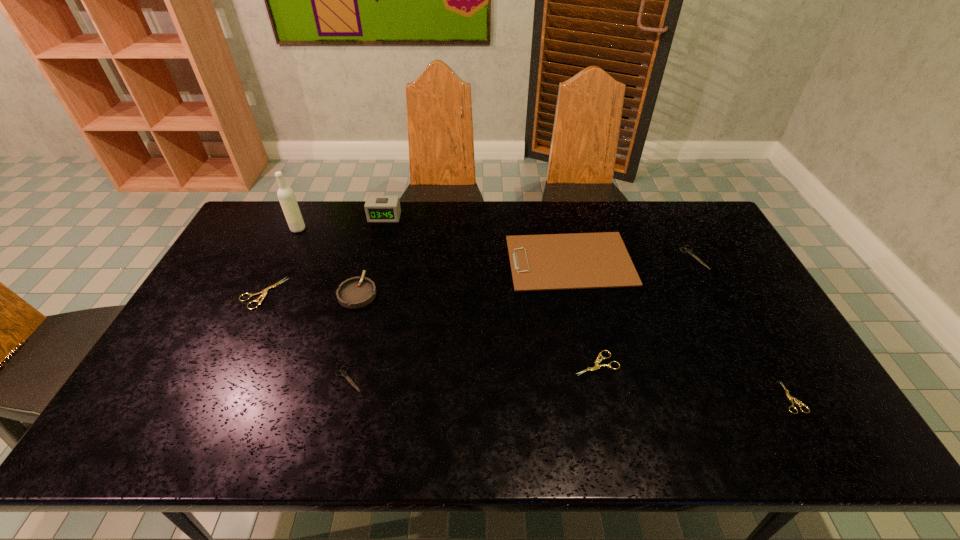
Where is `the fourth nearest shears`? Image resolution: width=960 pixels, height=540 pixels. the fourth nearest shears is located at coordinates (264, 293).

Where is `the farthest beige shears`? the farthest beige shears is located at coordinates (264, 293).

Identify the location of the second smallest beige shears. (597, 361).

Where is `the second nearest beige shears`? This screenshot has height=540, width=960. the second nearest beige shears is located at coordinates (597, 361).

The height and width of the screenshot is (540, 960). I want to click on the fourth shears from right to left, so click(x=343, y=373).

Image resolution: width=960 pixels, height=540 pixels. Identify the location of the smaller black shears. (343, 373).

Find the location of a particular element. the shortest object is located at coordinates (790, 398).

Locate an element on the screen. The image size is (960, 540). the nearest beige shears is located at coordinates (790, 398).

This screenshot has height=540, width=960. What are the coordinates of `vacant area situated on the right of the tallest object` in the screenshot? It's located at (359, 229).

Where is `free space located on the front-facing side of the alarm clock`? The image size is (960, 540). free space located on the front-facing side of the alarm clock is located at coordinates (376, 249).